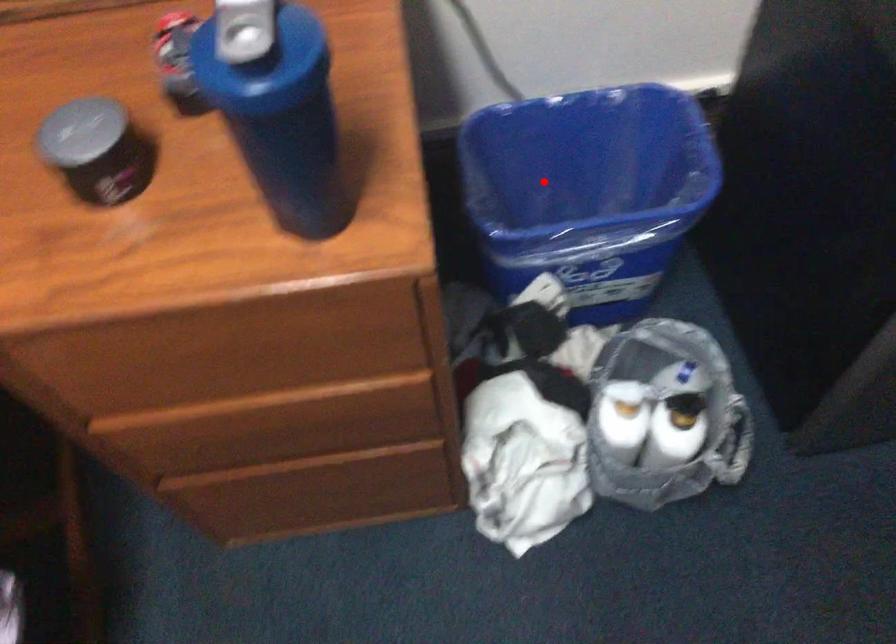
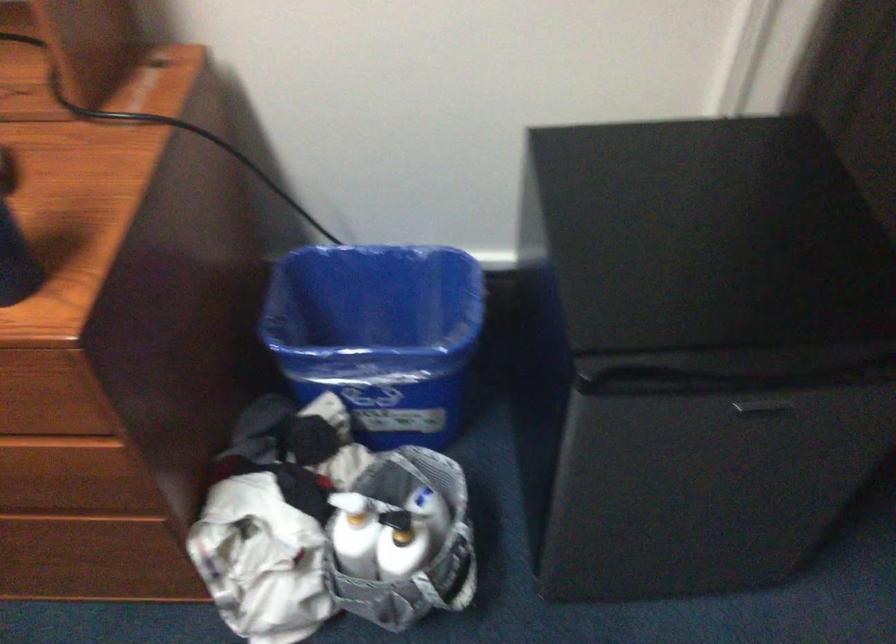
In the second image, find the point that corresponds to the highlighted location in the first image.

(367, 317)